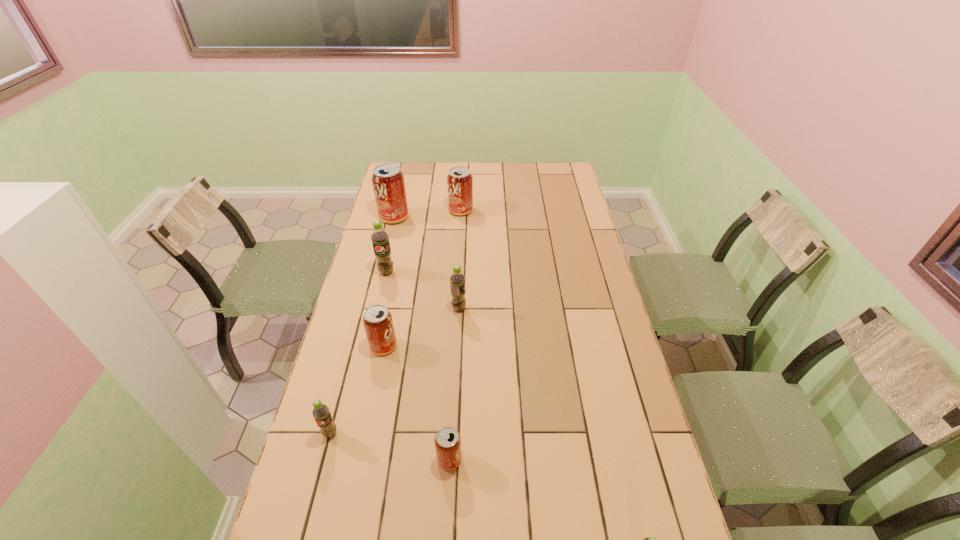
In order to click on free space at the left edge of the desktop in this screenshot , I will do `click(380, 276)`.

This screenshot has height=540, width=960. In the image, there is a desktop. Find the location of `vacant space at the right edge`. vacant space at the right edge is located at coordinates (570, 199).

At what (x,y) coordinates should I click in order to perform the action: click on vacant region between the biggest red soda can and the seventh farthest soda. Please return your answer as a coordinate pair (x, y). Image resolution: width=960 pixels, height=540 pixels. Looking at the image, I should click on (421, 338).

Identify the location of vacant region between the second nearest object and the second biggest green soda. coord(454,384).

The image size is (960, 540). I want to click on vacant area that lies between the fifth farthest soda and the second biggest red soda can, so click(x=422, y=278).

Identify the location of vacant area that lies between the second smallest red soda can and the third nearest green soda. (421, 327).

Choose which object is the third nearest neighbor to the second nearest object. Please provide its 2D coordinates. Your answer should be formatted as a tuple, i.e. [(x, y)], where the tuple contains the x and y coordinates of a point satisfying the conditions above.

[(647, 539)]

At what (x,y) coordinates should I click in order to perform the action: click on the sixth closest object to the nearest red soda can. Please return your answer as a coordinate pair (x, y). The width and height of the screenshot is (960, 540). Looking at the image, I should click on (388, 182).

Where is `the sixth closest soda to the biggest green soda`? The width and height of the screenshot is (960, 540). the sixth closest soda to the biggest green soda is located at coordinates (447, 441).

At what (x,y) coordinates should I click in order to perform the action: click on the fifth closest soda to the second biggest green soda. Please return your answer as a coordinate pair (x, y). The height and width of the screenshot is (540, 960). Looking at the image, I should click on (321, 414).